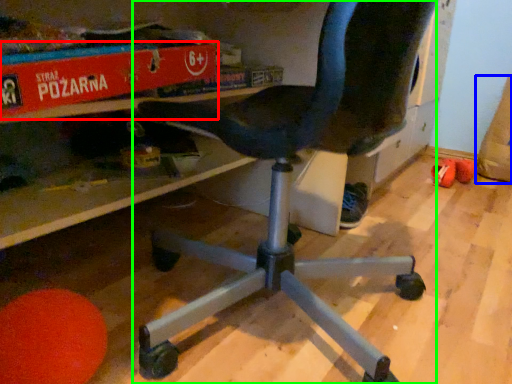
Question: Which object is positioned closest to paperback book (highlighted by a red box)? Select from bean bag chair (highlighted by a blue box) and chair (highlighted by a green box).

Choices:
 (A) bean bag chair
 (B) chair

Answer: (B)